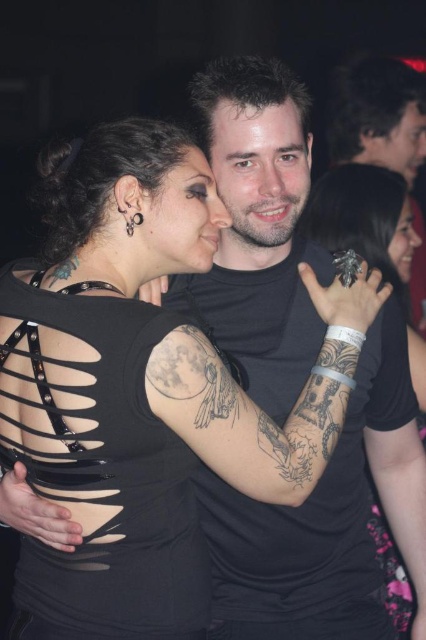
Question: Which is farther from the smooth skin face at upper right?

Choices:
 (A) matte black face at center
 (B) smooth skin face at center
 (C) matte black hair at upper right
 (D) black matte ring at upper right

Answer: (C)

Question: Can you confirm if smooth skin face at center is positioned below matte black face at center?

Choices:
 (A) no
 (B) yes

Answer: (A)

Question: Is the position of black matte ring at upper right more distant than that of matte black face at center?

Choices:
 (A) yes
 (B) no

Answer: (A)

Question: Does black matte ring at upper right appear over matte black face at center?

Choices:
 (A) yes
 (B) no

Answer: (B)

Question: Which object is the farthest from the matte black face at center?

Choices:
 (A) smooth skin face at center
 (B) matte black hair at upper right
 (C) black matte ring at upper right

Answer: (B)

Question: Which point appears closest to the camera in this image?

Choices:
 (A) (402, 630)
 (B) (293, 157)

Answer: (B)